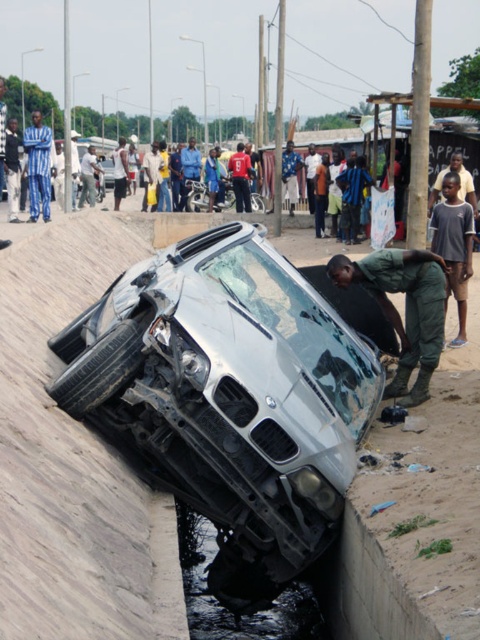
Is blue striped fabric at upper left to the right of blue striped shirt at upper left from the viewer's perspective?

Yes, blue striped fabric at upper left is to the right of blue striped shirt at upper left.

Can you confirm if blue striped fabric at upper left is positioned above blue striped shirt at upper left?

A: No.

This screenshot has width=480, height=640. Find the location of `blue striped fabric at upper left`. blue striped fabric at upper left is located at coordinates (37, 166).

Is red fabric shirt at center positioned at the back of silver metallic car at center?

No, red fabric shirt at center is closer to the viewer.

Between point (240, 141) and point (103, 170), which one is positioned in front?

Positioned in front is point (103, 170).

Who is more forward, (238, 182) or (103, 172)?

Positioned in front is point (238, 182).

Locate an element on the screen. red fabric shirt at center is located at coordinates (240, 177).

From the picture: Who is shorter, blue striped fabric at upper left or silver metallic car at center?

Standing shorter between the two is blue striped fabric at upper left.

Which is more to the right, blue striped fabric at upper left or silver metallic car at center?

blue striped fabric at upper left is more to the right.

Is point (40, 195) behind point (111, 161)?

No, it is in front of (111, 161).

Locate an element on the screen. This screenshot has height=640, width=480. blue striped fabric at upper left is located at coordinates (37, 166).